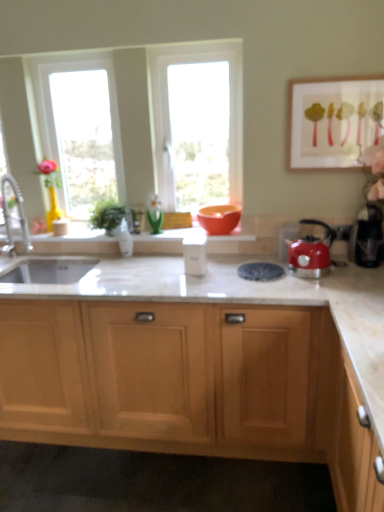
You are a GUI agent. You are given a task and a screenshot of the screen. Output one action in this format:
    pyautogui.click(x=<x>, y=<y>)
    Task: Click on the free area in between white glossy container at center and clear glass vase at center, which is the 2th glass vase from right to left
    
    Given the screenshot: What is the action you would take?
    pyautogui.click(x=153, y=265)